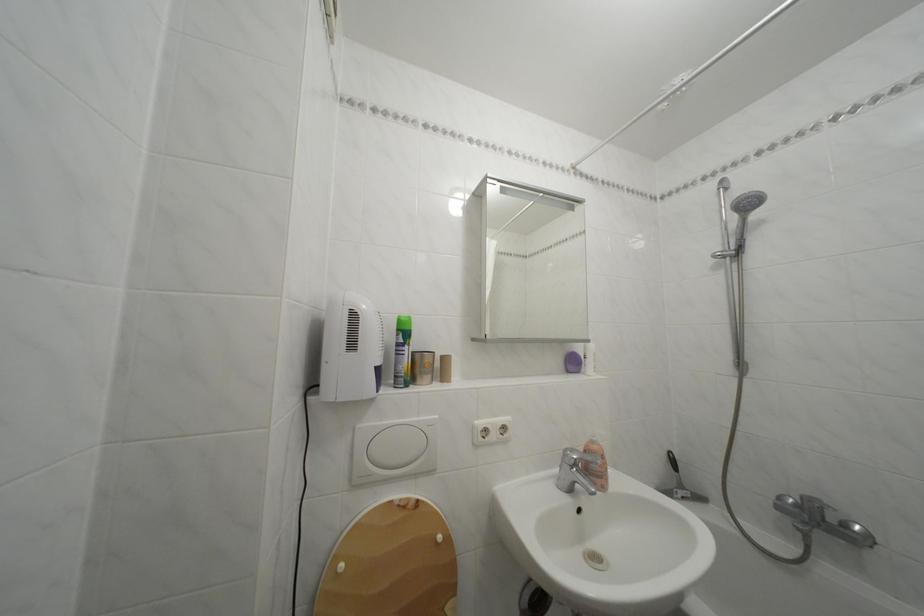
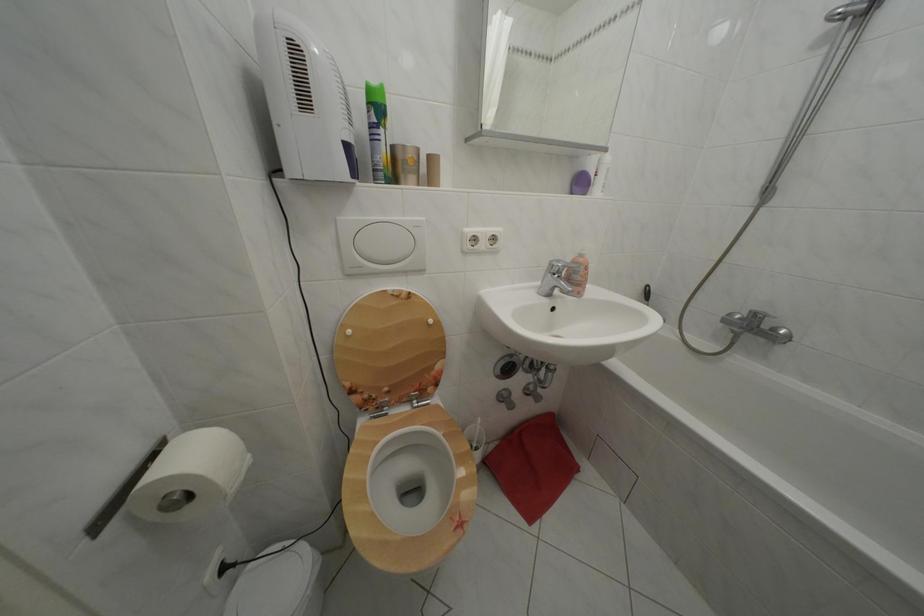
The point at (581, 456) is marked in the first image. Where is the corresponding point in the second image?

(567, 268)